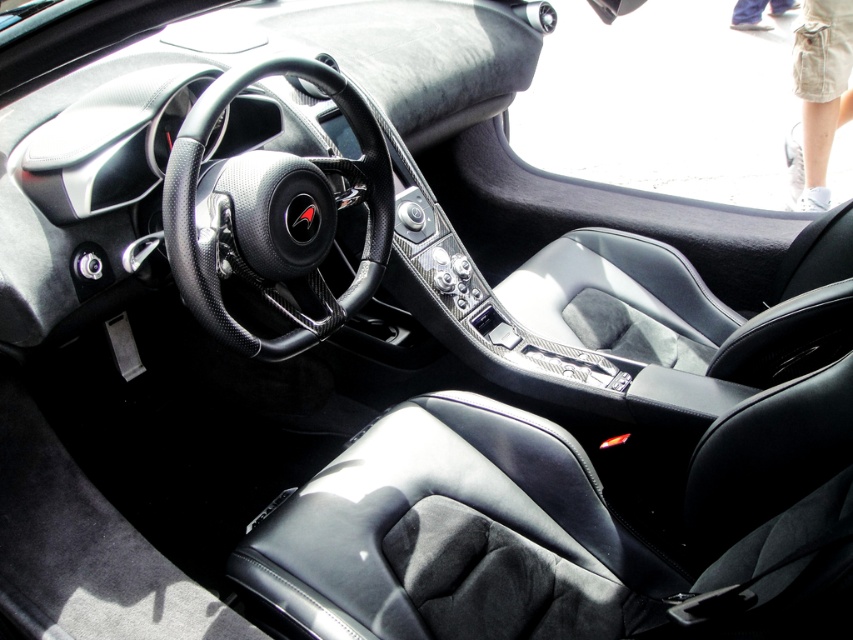
Measure the distance between point [189,228] and camera.

Point [189,228] is 3.69 feet from camera.

Who is positioned more to the left, carbon fiber steering wheel at center or black leather seat at center?

carbon fiber steering wheel at center

Is point (253, 243) in front of point (837, 26)?

Yes, it is in front of point (837, 26).

The width and height of the screenshot is (853, 640). What are the coordinates of `carbon fiber steering wheel at center` in the screenshot? It's located at (273, 216).